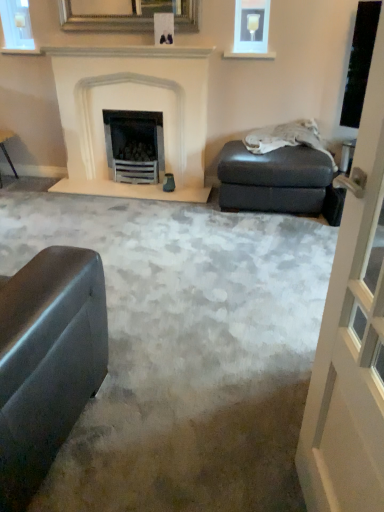
What is the approximate width of white stone fireplace at center?

white stone fireplace at center is 22.38 inches in width.

The image size is (384, 512). I want to click on matte gray footrest at right, so click(x=273, y=179).

Identify the location of matte glass frame at upper right, which ranks as the first picture frame in right-to-left order. (251, 26).

Is clear glass candle at upper left behind white stone fireplace at center?

That is True.

Considering the positions of point (9, 44) and point (74, 106), is point (9, 44) closer or farther from the camera than point (74, 106)?

Point (9, 44) appears to be closer to the viewer than point (74, 106).

In order to click on window above the white stone fireplace at center (from the image's perspective) in this screenshot , I will do `click(17, 26)`.

Consider the image. Considering the positions of objects matte glass frame at upper right, which ranks as the first picture frame in right-to-left order, and matte gray footrest at right in the image provided, who is in front, matte glass frame at upper right, which ranks as the first picture frame in right-to-left order, or matte gray footrest at right?

matte gray footrest at right is in front.

From the image's perspective, is matte glass frame at upper right, which ranks as the first picture frame in right-to-left order, above matte gray footrest at right?

Indeed, from the image's perspective, matte glass frame at upper right, which ranks as the first picture frame in right-to-left order, is shown above matte gray footrest at right.

Considering the points (251, 26) and (327, 178), which point is in front, point (251, 26) or point (327, 178)?

The point (327, 178) is closer to the camera.

Which is correct: matte glass frame at upper right, the 2th picture frame viewed from the left, is inside matte gray footrest at right, or outside of it?

matte glass frame at upper right, the 2th picture frame viewed from the left, is not inside matte gray footrest at right, it's outside.

Which of these two, matte gray footrest at right or white stone fireplace at center, stands shorter?

matte gray footrest at right.

From the picture: From the image's perspective, between matte gray footrest at right and white stone fireplace at center, which one is located above?

white stone fireplace at center, from the image's perspective.

Considering the sizes of objects matte gray footrest at right and white stone fireplace at center in the image provided, who is smaller, matte gray footrest at right or white stone fireplace at center?

matte gray footrest at right.

From a real-world perspective, which object rests below the other?

matte gray footrest at right is physically lower.

What are the coordinates of `the 1st picture frame above the transparent glass screen door at right (from the image's perspective)` in the screenshot? It's located at (251, 26).

From the image's perspective, which one is positioned higher, transparent glass screen door at right or matte glass frame at upper right, which ranks as the first picture frame in right-to-left order?

matte glass frame at upper right, which ranks as the first picture frame in right-to-left order.

Can you confirm if transparent glass screen door at right is wider than matte glass frame at upper right, the 2th picture frame viewed from the left?

Correct, the width of transparent glass screen door at right exceeds that of matte glass frame at upper right, the 2th picture frame viewed from the left.

Considering the relative sizes of matte gray footrest at right and gold-framed mirror at upper center, positioned as the 2th picture frame in right-to-left order, in the image provided, is matte gray footrest at right shorter than gold-framed mirror at upper center, positioned as the 2th picture frame in right-to-left order,?

In fact, matte gray footrest at right may be taller than gold-framed mirror at upper center, positioned as the 2th picture frame in right-to-left order.

Can you confirm if matte gray footrest at right is positioned to the left of gold-framed mirror at upper center, which is the first picture frame in left-to-right order?

No, matte gray footrest at right is not to the left of gold-framed mirror at upper center, which is the first picture frame in left-to-right order.

Between matte gray footrest at right and gold-framed mirror at upper center, which is the first picture frame in left-to-right order, which one has smaller size?

gold-framed mirror at upper center, which is the first picture frame in left-to-right order, is smaller.

Can you tell me how much matte gray footrest at right and gold-framed mirror at upper center, positioned as the 2th picture frame in right-to-left order, differ in facing direction?

0.305 degrees separate the facing orientations of matte gray footrest at right and gold-framed mirror at upper center, positioned as the 2th picture frame in right-to-left order.

In the image, is matte gray footrest at right positioned in front of or behind matte glass frame at upper right, the 2th picture frame viewed from the left?

matte gray footrest at right is positioned closer to the viewer than matte glass frame at upper right, the 2th picture frame viewed from the left.

Is matte gray footrest at right oriented away from matte glass frame at upper right, which ranks as the first picture frame in right-to-left order?

No, matte gray footrest at right is not facing the opposite direction of matte glass frame at upper right, which ranks as the first picture frame in right-to-left order.

Visually, is matte gray footrest at right positioned to the left or to the right of matte glass frame at upper right, the 2th picture frame viewed from the left?

matte gray footrest at right is to the right of matte glass frame at upper right, the 2th picture frame viewed from the left.

Between transparent glass screen door at right and white stone fireplace at center, which one has less height?

white stone fireplace at center.

Locate an element on the screen. Image resolution: width=384 pixels, height=512 pixels. screen door on the right of white stone fireplace at center is located at coordinates (352, 335).

This screenshot has height=512, width=384. In order to click on window that is above the white stone fireplace at center (from a real-world perspective) in this screenshot , I will do `click(17, 26)`.

Locate an element on the screen. The width and height of the screenshot is (384, 512). footrest lying on the right of matte glass frame at upper right, which ranks as the first picture frame in right-to-left order is located at coordinates (273, 179).

When comparing their distances from matte gray footrest at right, does clear glass candle at upper left or white stone fireplace at center seem further?

Based on the image, clear glass candle at upper left appears to be further to matte gray footrest at right.

Estimate the real-world distances between objects in this image. Which object is further from gold-framed mirror at upper center, which is the first picture frame in left-to-right order, matte gray footrest at right or transparent glass screen door at right?

A: The object further to gold-framed mirror at upper center, which is the first picture frame in left-to-right order, is transparent glass screen door at right.

Based on their spatial positions, is clear glass candle at upper left or white stone fireplace at center closer to matte glass frame at upper right, which ranks as the first picture frame in right-to-left order?

The object closer to matte glass frame at upper right, which ranks as the first picture frame in right-to-left order, is white stone fireplace at center.

Consider the image. From the image, which object appears to be nearer to clear glass candle at upper left, matte glass frame at upper right, which ranks as the first picture frame in right-to-left order, or white stone fireplace at center?

white stone fireplace at center lies closer to clear glass candle at upper left than the other object.

Which object lies further to the anchor point matte gray footrest at right, transparent glass screen door at right or gold-framed mirror at upper center, which is the first picture frame in left-to-right order?

transparent glass screen door at right is further to matte gray footrest at right.

Looking at the image, which one is located further to gold-framed mirror at upper center, positioned as the 2th picture frame in right-to-left order, matte gray footrest at right or matte glass frame at upper right, the 2th picture frame viewed from the left?

matte gray footrest at right lies further to gold-framed mirror at upper center, positioned as the 2th picture frame in right-to-left order, than the other object.

Based on their spatial positions, is matte gray footrest at right or white stone fireplace at center further from gold-framed mirror at upper center, which is the first picture frame in left-to-right order?

Among the two, matte gray footrest at right is located further to gold-framed mirror at upper center, which is the first picture frame in left-to-right order.

Consider the image. From the image, which object appears to be nearer to gold-framed mirror at upper center, positioned as the 2th picture frame in right-to-left order, matte glass frame at upper right, the 2th picture frame viewed from the left, or transparent glass screen door at right?

The object closer to gold-framed mirror at upper center, positioned as the 2th picture frame in right-to-left order, is matte glass frame at upper right, the 2th picture frame viewed from the left.

Image resolution: width=384 pixels, height=512 pixels. What are the coordinates of `fireplace between clear glass candle at upper left and gold-framed mirror at upper center, which is the first picture frame in left-to-right order` in the screenshot? It's located at (133, 109).

This screenshot has width=384, height=512. What are the coordinates of `picture frame between white stone fireplace at center and matte glass frame at upper right, the 2th picture frame viewed from the left` in the screenshot? It's located at (129, 16).

Identify the location of fireplace between transparent glass screen door at right and matte glass frame at upper right, which ranks as the first picture frame in right-to-left order, in the front-back direction. (133, 109).

The image size is (384, 512). In order to click on picture frame between transparent glass screen door at right and matte glass frame at upper right, the 2th picture frame viewed from the left, from front to back in this screenshot , I will do `click(129, 16)`.